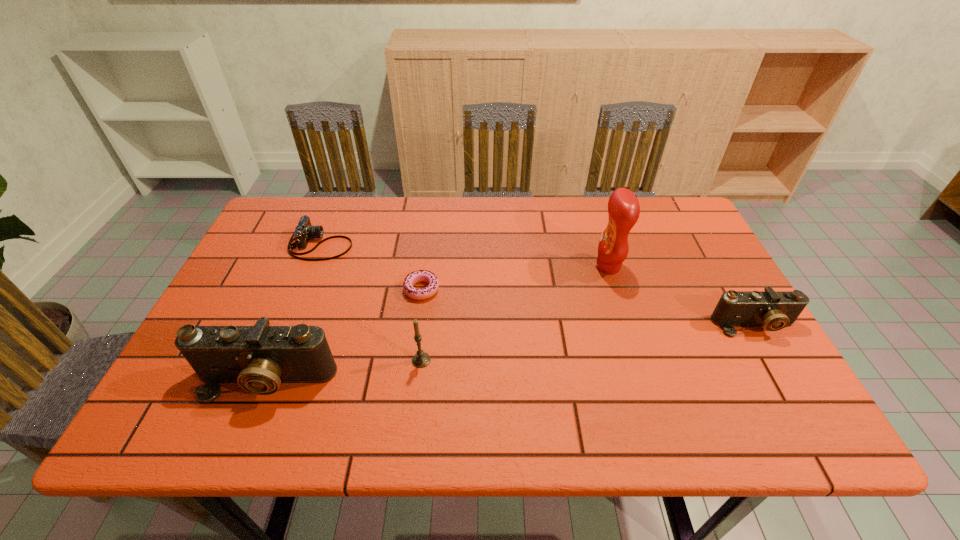
Locate which camera ranks second in proximity to the tallest camera. Please provide its 2D coordinates. Your answer should be formatted as a tuple, i.e. [(x, y)], where the tuple contains the x and y coordinates of a point satisfying the conditions above.

[(774, 310)]

Find the location of a particular element. The width and height of the screenshot is (960, 540). vacant space that satisfies the following two spatial constraints: 1. on the back side of the candle; 2. on the front-facing side of the fifth tallest object is located at coordinates (435, 244).

Locate an element on the screen. The image size is (960, 540). free space that satisfies the following two spatial constraints: 1. on the label side of the fifth object from left to right; 2. on the front side of the shortest object is located at coordinates (615, 289).

In order to click on vacant space that satisfies the following two spatial constraints: 1. on the back side of the doughnut; 2. on the front-facing side of the shortest camera in this screenshot , I will do `click(427, 244)`.